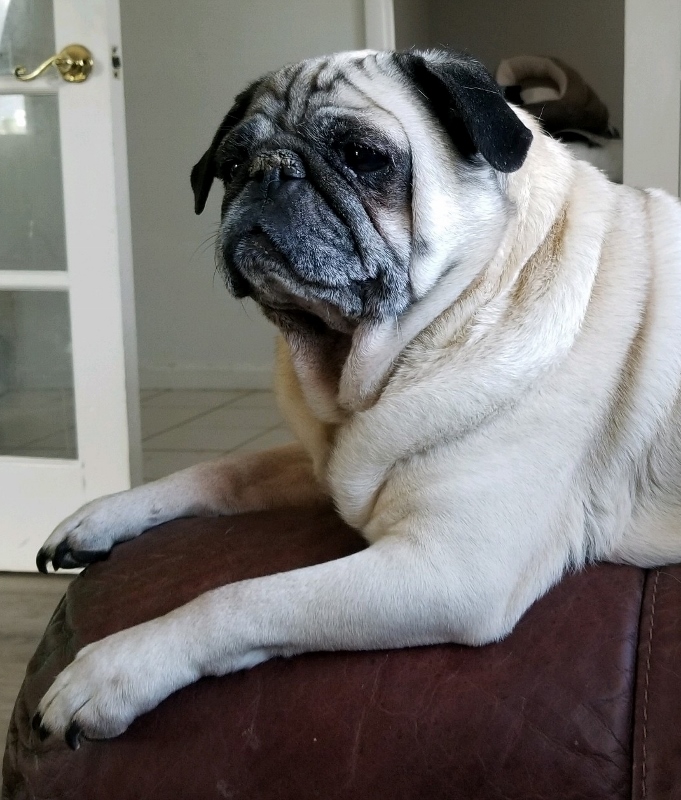
Identify the location of tile floor. (216, 422).